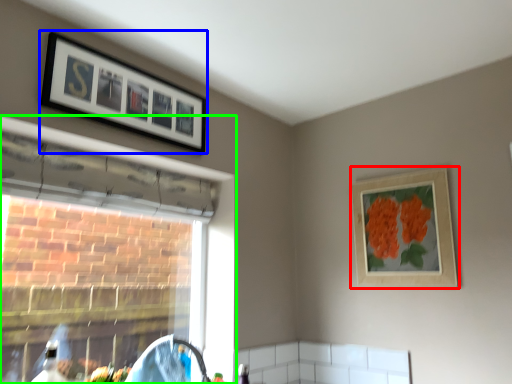
Question: Which is farther away from picture frame (highlighted by a red box)? picture frame (highlighted by a blue box) or window (highlighted by a green box)?

Choices:
 (A) picture frame
 (B) window

Answer: (A)